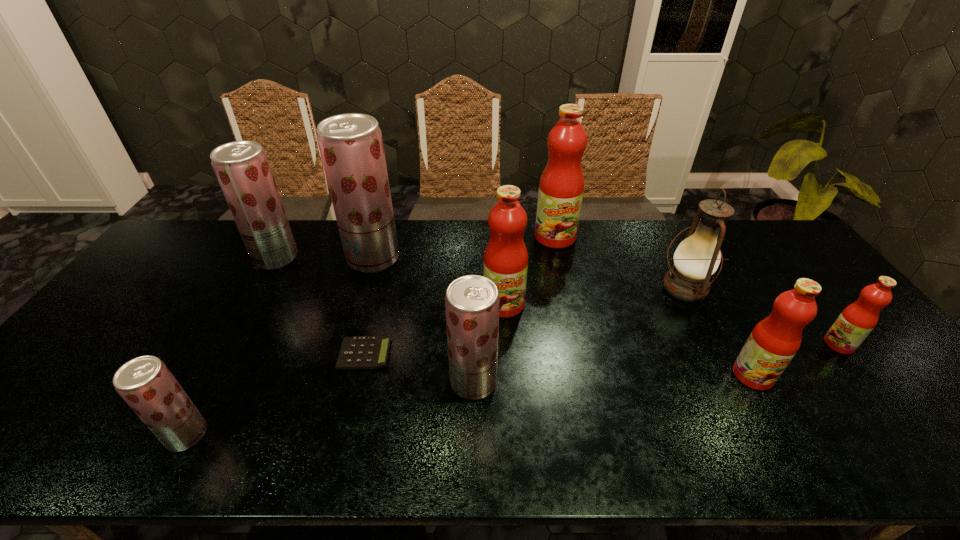
Find the location of a particular element. the second strawberry fruit juice from right to left is located at coordinates (351, 146).

Locate an element on the screen. This screenshot has width=960, height=540. the biggest strawberry fruit juice is located at coordinates (351, 146).

Find the location of a particular element. the third pink fruit juice from right to left is located at coordinates (561, 187).

This screenshot has height=540, width=960. I want to click on the seventh object from left to right, so click(561, 187).

At what (x,y) coordinates should I click in order to perform the action: click on the third smallest strawberry fruit juice. Please return your answer as a coordinate pair (x, y). Looking at the image, I should click on (242, 168).

This screenshot has height=540, width=960. I want to click on the third smallest pink fruit juice, so click(506, 258).

The height and width of the screenshot is (540, 960). What are the coordinates of `the leftmost pink fruit juice` in the screenshot? It's located at (506, 258).

You are a GUI agent. You are given a task and a screenshot of the screen. Output one action in this format:
    pyautogui.click(x=<x>, y=<y>)
    Task: Click on the oil lamp
    This screenshot has width=960, height=540.
    Given the screenshot: What is the action you would take?
    pyautogui.click(x=697, y=257)

Locate an element on the screen. the nearest pink fruit juice is located at coordinates (774, 341).

Locate an element on the screen. the third biggest pink fruit juice is located at coordinates (774, 341).